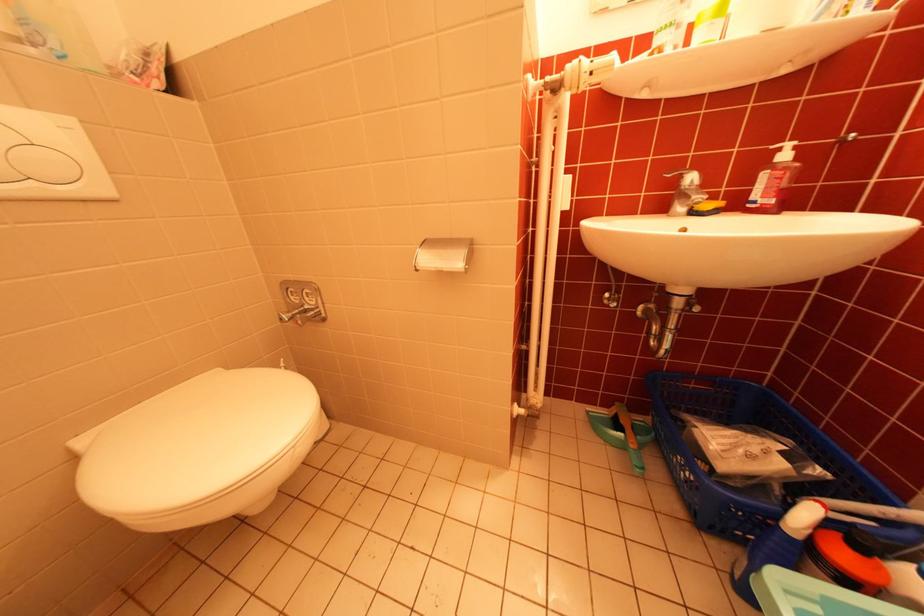
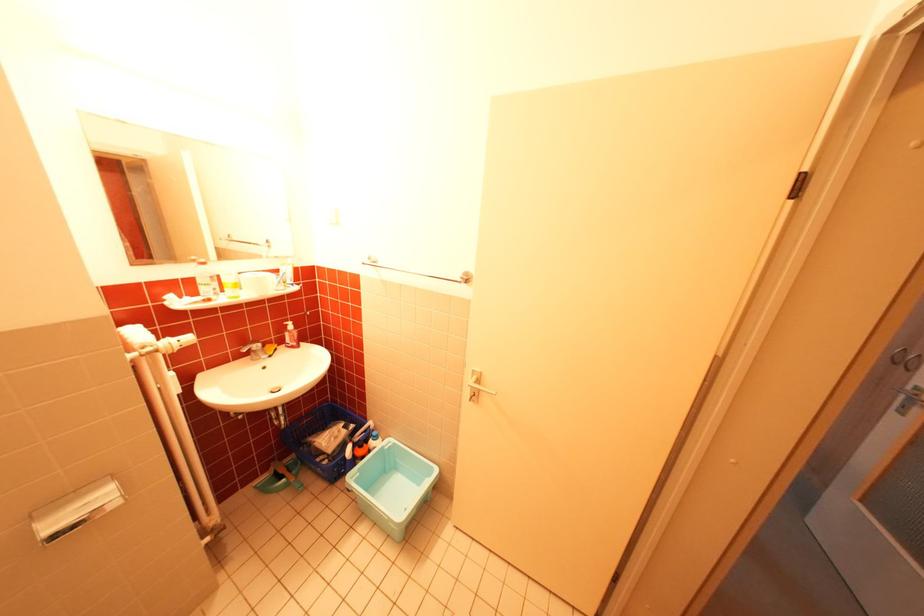
In the second image, find the point that corresponds to point (821, 512) in the first image.

(360, 448)